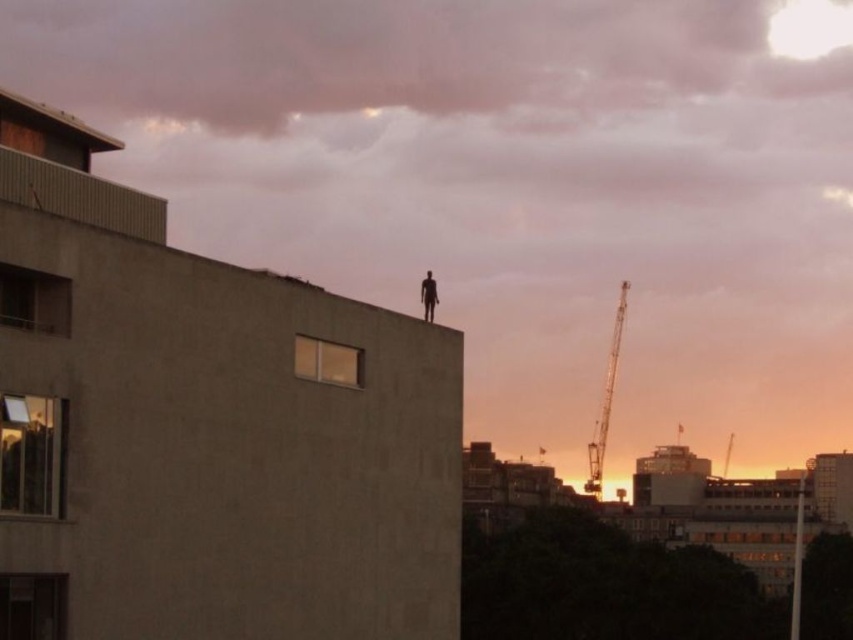
You are an urban planner reviewing this cityscape. You need to determine the relative positions of the metallic gray crane at right and the silhouette figure at center. Which object is positioned to the right of the other?

The metallic gray crane at right is to the right of the silhouette figure at center.

You are a city planner analyzing the skyline. Based on the image, which object occupies more horizontal space in the scene? The pink fluffy cloud at upper center or the metallic gray crane at right?

The pink fluffy cloud at upper center might be wider than metallic gray crane at right according to the description.